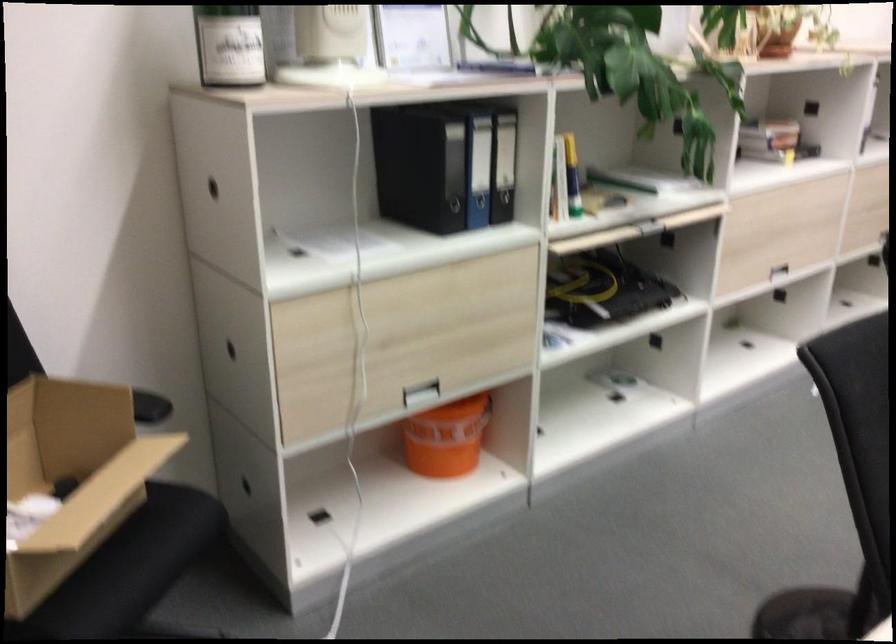
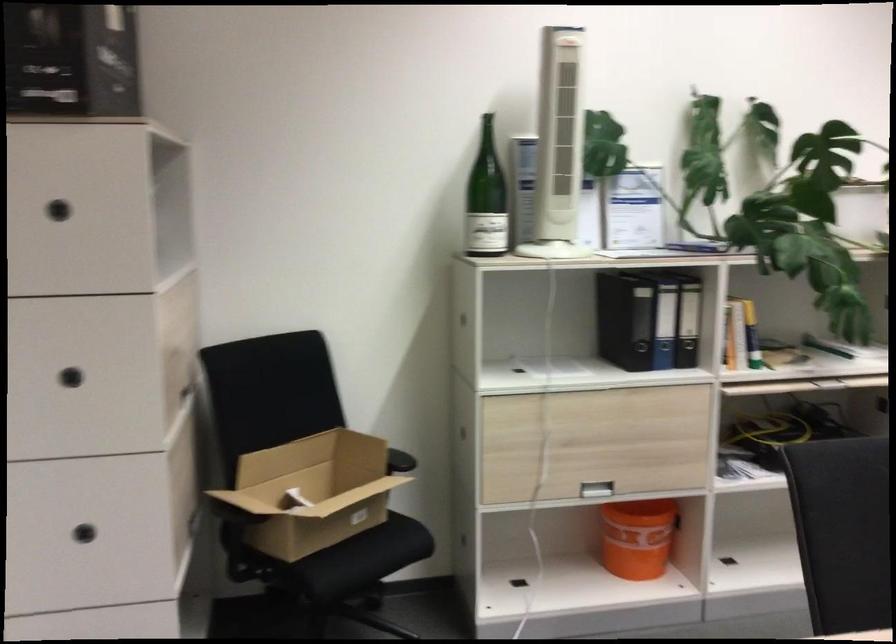
Find the pixel in the second image that matches (x=160, y=552) in the first image.

(381, 545)